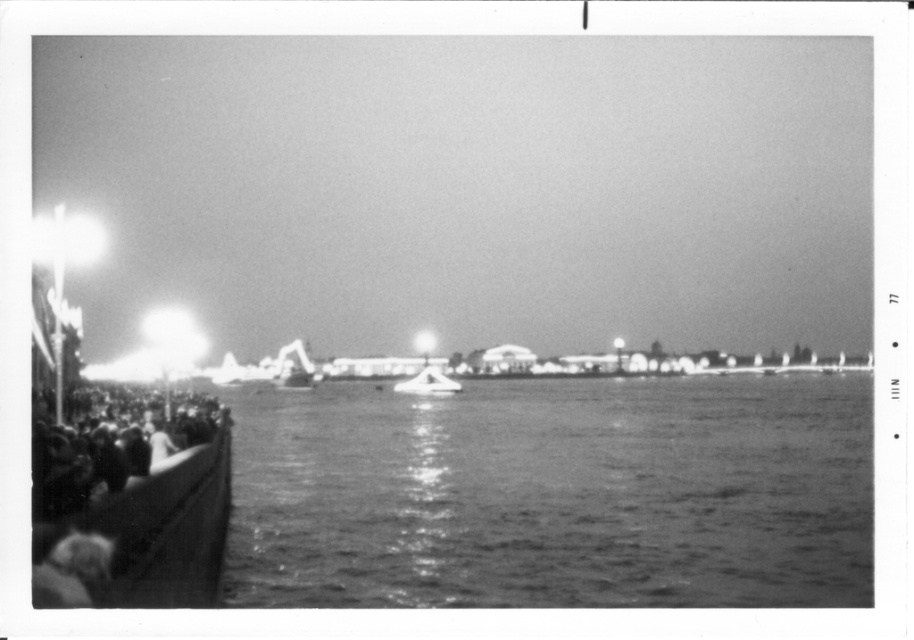
Question: Based on their relative distances, which object is nearer to the dark gray textured crowd at left?

Choices:
 (A) smooth water at center
 (B) metallic silver boat at center

Answer: (A)

Question: Which of the following is the farthest from the observer?

Choices:
 (A) smooth water at center
 (B) metallic silver boat at center
 (C) dark gray textured crowd at left

Answer: (B)

Question: Can you confirm if smooth water at center is bigger than metallic silver boat at center?

Choices:
 (A) no
 (B) yes

Answer: (B)

Question: Considering the relative positions of smooth water at center and metallic silver boat at center in the image provided, where is smooth water at center located with respect to metallic silver boat at center?

Choices:
 (A) right
 (B) left

Answer: (A)

Question: Does smooth water at center appear over metallic silver boat at center?

Choices:
 (A) no
 (B) yes

Answer: (A)

Question: Which object is closer to the camera taking this photo?

Choices:
 (A) smooth water at center
 (B) dark gray textured crowd at left

Answer: (B)